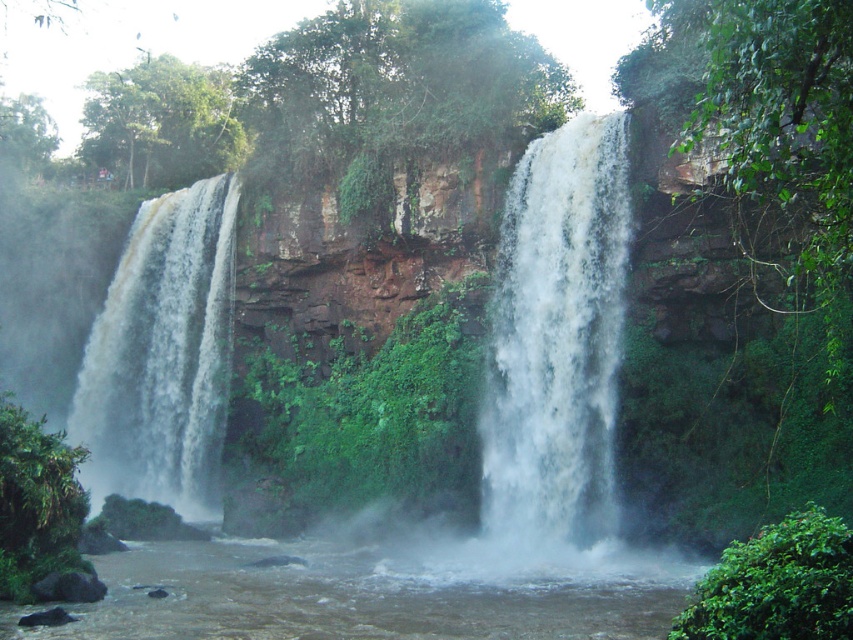
Who is shorter, brown muddy water at lower center or white frothy water at center?

With less height is brown muddy water at lower center.

Who is positioned more to the right, brown muddy water at lower center or white frothy water at center?

white frothy water at center

Does point (28, 628) come behind point (490, 490)?

No, it is not.

I want to click on brown muddy water at lower center, so click(375, 592).

Who is taller, white frothy water at center or white frothy water at left?

white frothy water at left

From the picture: Can you confirm if white frothy water at center is positioned above white frothy water at left?

Yes, white frothy water at center is above white frothy water at left.

What do you see at coordinates (556, 337) in the screenshot? The image size is (853, 640). I see `white frothy water at center` at bounding box center [556, 337].

Find the location of a particular element. The image size is (853, 640). white frothy water at center is located at coordinates (556, 337).

Is brown muddy water at lower center thinner than white frothy water at left?

Incorrect, brown muddy water at lower center's width is not less than white frothy water at left's.

Describe the element at coordinates (375, 592) in the screenshot. Image resolution: width=853 pixels, height=640 pixels. I see `brown muddy water at lower center` at that location.

Between point (115, 564) and point (86, 388), which one is positioned behind?

The point (86, 388) is behind.

The width and height of the screenshot is (853, 640). I want to click on brown muddy water at lower center, so click(375, 592).